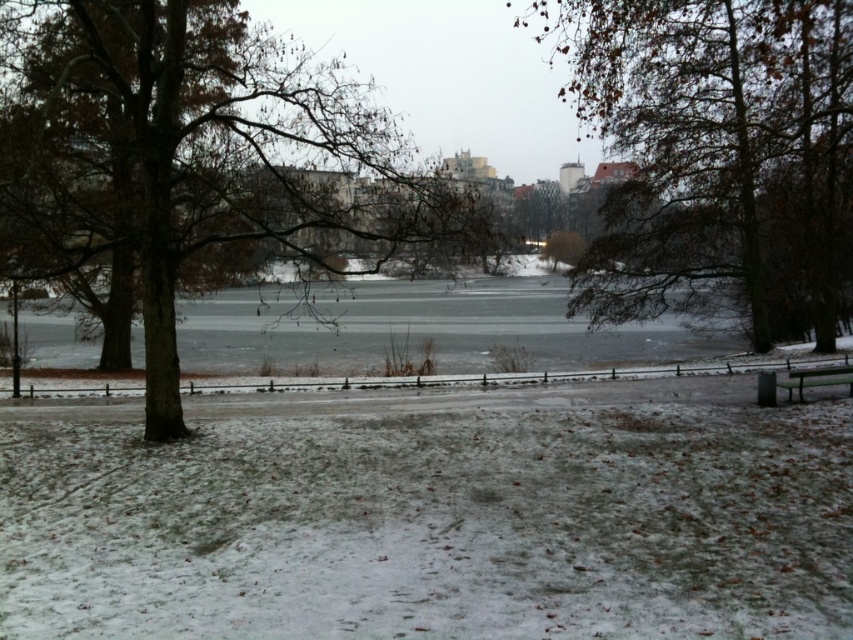
Does brown/drytree at left appear under wooden bench at lower right?

Actually, brown/drytree at left is above wooden bench at lower right.

Is brown/drytree at left closer to camera compared to wooden bench at lower right?

Yes, brown/drytree at left is in front of wooden bench at lower right.

Which is in front, point (259, 92) or point (759, 376)?

Point (259, 92) is in front.

Locate an element on the screen. brown/drytree at left is located at coordinates (198, 157).

Which is more to the left, brown leafy tree at center or wooden bench at lower right?

Positioned to the left is wooden bench at lower right.

Can you confirm if brown leafy tree at center is positioned to the left of wooden bench at lower right?

Incorrect, brown leafy tree at center is not on the left side of wooden bench at lower right.

Is point (709, 4) in front of point (788, 397)?

That is False.

Identify the location of brown leafy tree at center. This screenshot has width=853, height=640. (712, 150).

Who is positioned more to the left, brown/drytree at left or brown leafy tree at center?

brown/drytree at left

Where is `brown/drytree at left`? This screenshot has width=853, height=640. brown/drytree at left is located at coordinates (198, 157).